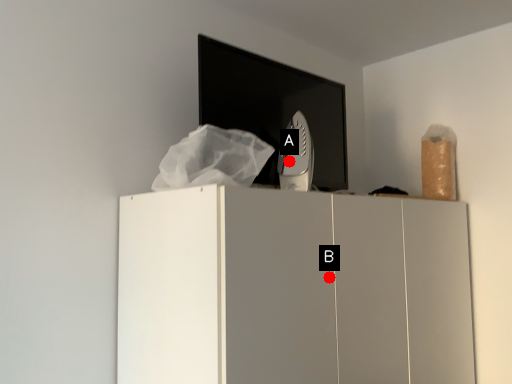
Question: Two points are circled on the image, labeled by A and B beside each circle. Which point is closer to the camera?

Choices:
 (A) A is closer
 (B) B is closer

Answer: (B)